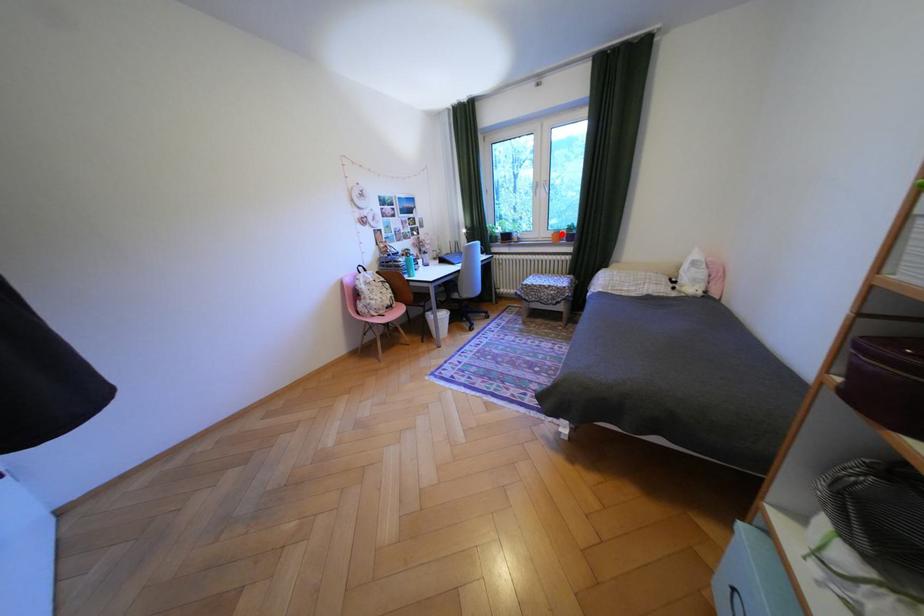
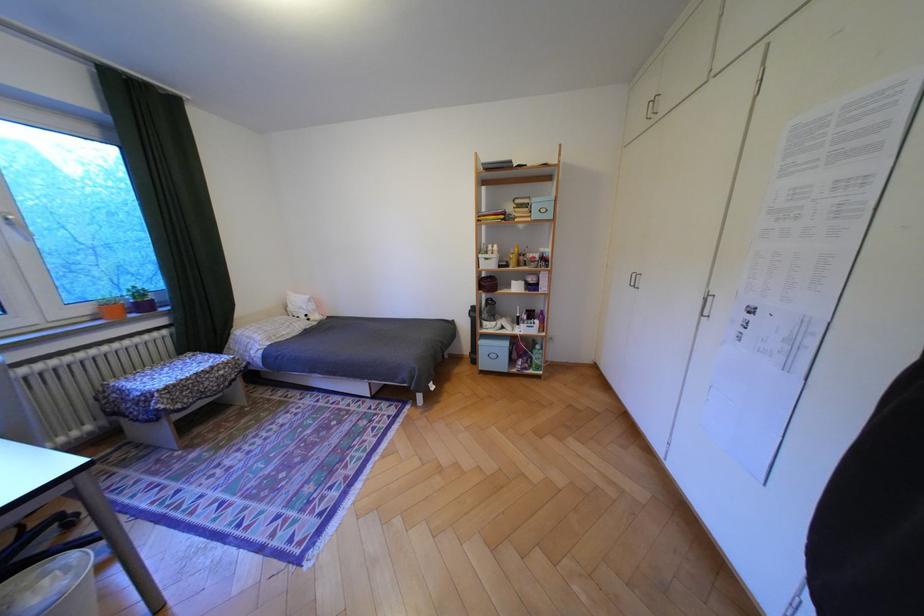
Question: I am providing you with two images of the same scene from different viewpoints. A red point is marked on the first image. Is the red point's position out of view in image 2?

Choices:
 (A) Yes
 (B) No

Answer: (B)